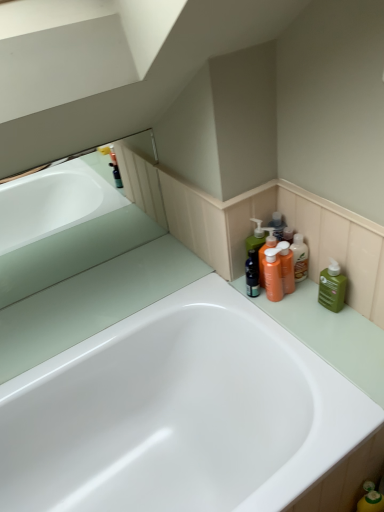
Question: From the image's perspective, is white glossy bathtub at center positioned above or below matte glass bathtub at upper left?

Choices:
 (A) below
 (B) above

Answer: (A)

Question: In terms of height, does white glossy bathtub at center look taller or shorter compared to matte glass bathtub at upper left?

Choices:
 (A) short
 (B) tall

Answer: (B)

Question: Estimate the real-world distances between objects in this image. Which object is closer to the green matte bottle at right, marked as the second cleaning product in a left-to-right arrangement?

Choices:
 (A) white glossy bathtub at center
 (B) orange matte pump bottle at upper right, the second cleaning product positioned from the right
 (C) translucent orange bottle at right
 (D) matte glass bathtub at upper left

Answer: (C)

Question: Considering the real-world distances, which object is farthest from the white glossy bathtub at center?

Choices:
 (A) green matte bottle at right, acting as the 1th cleaning product starting from the right
 (B) translucent orange bottle at right
 (C) matte glass bathtub at upper left
 (D) orange matte pump bottle at upper right, which is counted as the 1th cleaning product, starting from the left

Answer: (C)